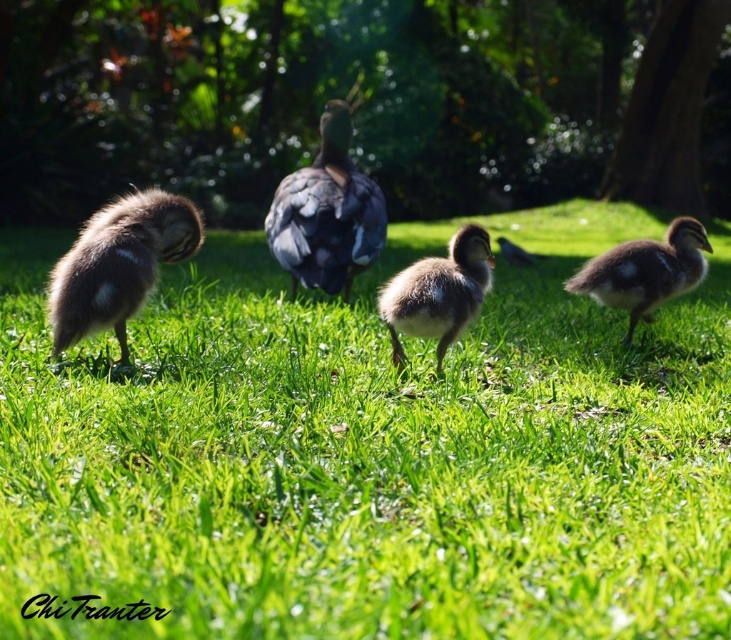
You are a photographer standing at the center of the grassy area. You want to take a photo of the soft brown downy duckling at center. Where should you aim your camera? Choose between the coordinates given in the objects list. The options are point (439, 292).

The point (439, 292) is on the soft brown downy duckling at center, so you should aim your camera at point (439, 292).

You are a photographer trying to capture a clear photo of the soft brown downy duckling at center and the dark gray feathers at center. Which duckling is located underneath the other?

The soft brown downy duckling at center is positioned under dark gray feathers at center.

You are standing at the point with coordinates (371,452) in the image. What object is located exactly at your current position?

The green soft grass at center is located exactly at the point (371,452).